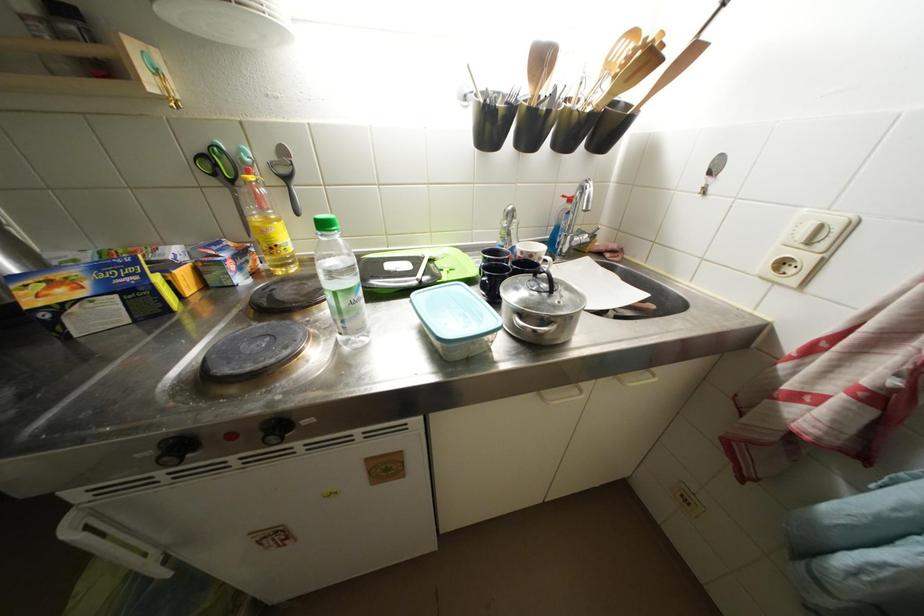
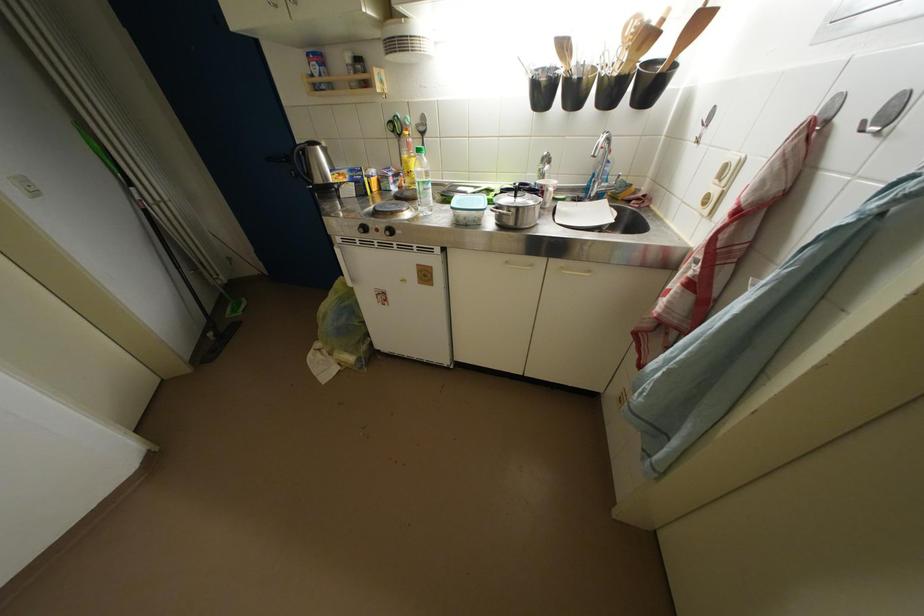
In the second image, find the point that corresponds to point (614, 90) in the first image.

(631, 60)